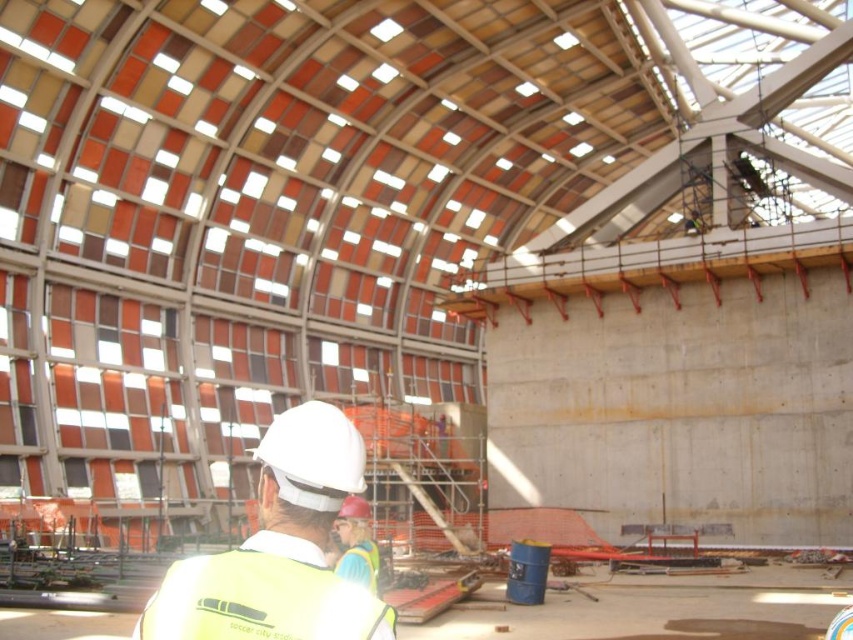
Question: Which point is farther from the camera taking this photo?

Choices:
 (A) click(x=314, y=448)
 (B) click(x=375, y=628)

Answer: (A)

Question: Can you confirm if yellow reflective vest at center is positioned to the right of yellow reflective safety vest at lower left?

Choices:
 (A) yes
 (B) no

Answer: (A)

Question: Does yellow reflective vest at center have a smaller size compared to yellow reflective safety vest at lower left?

Choices:
 (A) yes
 (B) no

Answer: (B)

Question: Among these objects, which one is farthest from the camera?

Choices:
 (A) yellow reflective vest at center
 (B) yellow reflective safety vest at lower left

Answer: (A)

Question: Which of the following is the closest to the observer?

Choices:
 (A) yellow reflective vest at center
 (B) yellow reflective safety vest at lower left

Answer: (B)

Question: Considering the relative positions of yellow reflective vest at center and yellow reflective safety vest at lower left in the image provided, where is yellow reflective vest at center located with respect to yellow reflective safety vest at lower left?

Choices:
 (A) above
 (B) below

Answer: (A)